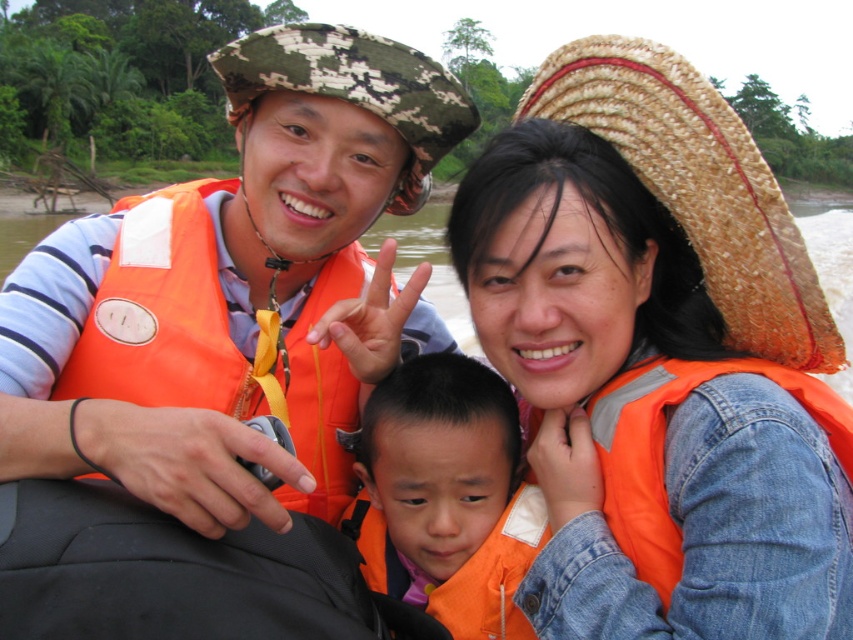
Question: Is strawmaterial/texturehat at upper right further to the viewer compared to orange life jacket at left?

Choices:
 (A) yes
 (B) no

Answer: (B)

Question: Is strawmaterial/texturehat at upper right further to camera compared to orange fabric life jacket at upper right?

Choices:
 (A) yes
 (B) no

Answer: (A)

Question: Considering the real-world distances, which object is closest to the orange life jacket at left?

Choices:
 (A) strawmaterial/texturehat at upper right
 (B) straw hat at upper right

Answer: (B)

Question: Which is farther from the straw hat at upper right?

Choices:
 (A) orange fabric life jacket at upper right
 (B) strawmaterial/texturehat at upper right

Answer: (A)

Question: Which point is closer to the camera taking this photo?

Choices:
 (A) (358, 509)
 (B) (757, 634)
 (C) (210, 362)

Answer: (B)

Question: Is orange life vest at upper right to the right of orange fabric life jacket at upper right from the viewer's perspective?

Choices:
 (A) no
 (B) yes

Answer: (A)